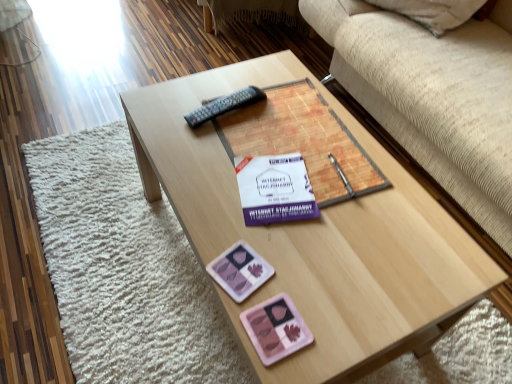
Identify the location of unoccupied space behind black plastic remote at center. The image size is (512, 384). (236, 81).